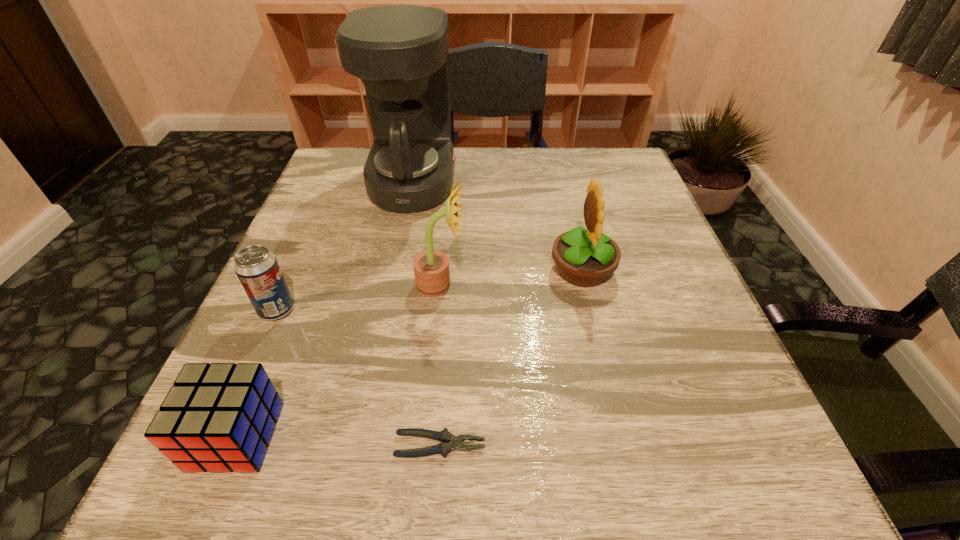
The image size is (960, 540). In order to click on the tallest object in this screenshot , I will do `click(400, 52)`.

In order to click on the farthest object in this screenshot , I will do `click(400, 52)`.

The height and width of the screenshot is (540, 960). Find the location of `the left sunflower`. the left sunflower is located at coordinates (431, 268).

Find the location of a particular element. The height and width of the screenshot is (540, 960). the rightmost object is located at coordinates (585, 258).

At what (x,y) coordinates should I click in order to perform the action: click on beer can. Please return your answer as a coordinate pair (x, y). Looking at the image, I should click on (257, 268).

Image resolution: width=960 pixels, height=540 pixels. Identify the location of cube. 220,417.

The image size is (960, 540). I want to click on pliers, so tap(445, 437).

Locate an element on the screen. vacant space located 0.290m on the button side of the coffee maker is located at coordinates (573, 183).

Locate an element on the screen. vacant area located 0.210m on the face of the left sunflower is located at coordinates (577, 285).

In order to click on vacant region located 0.050m on the face of the rightmost object in this screenshot , I will do `click(524, 270)`.